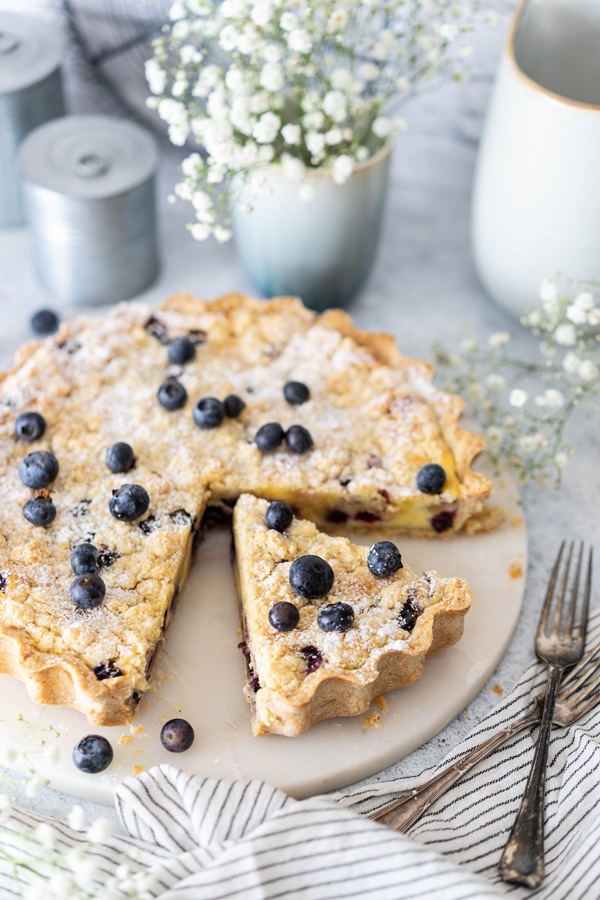
Where is `striped linen`? striped linen is located at coordinates (260, 871).